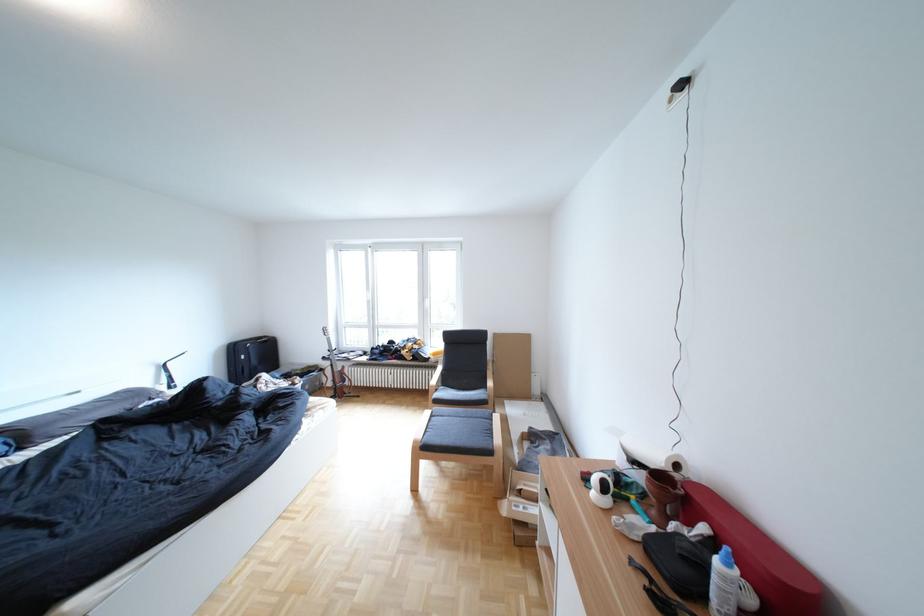
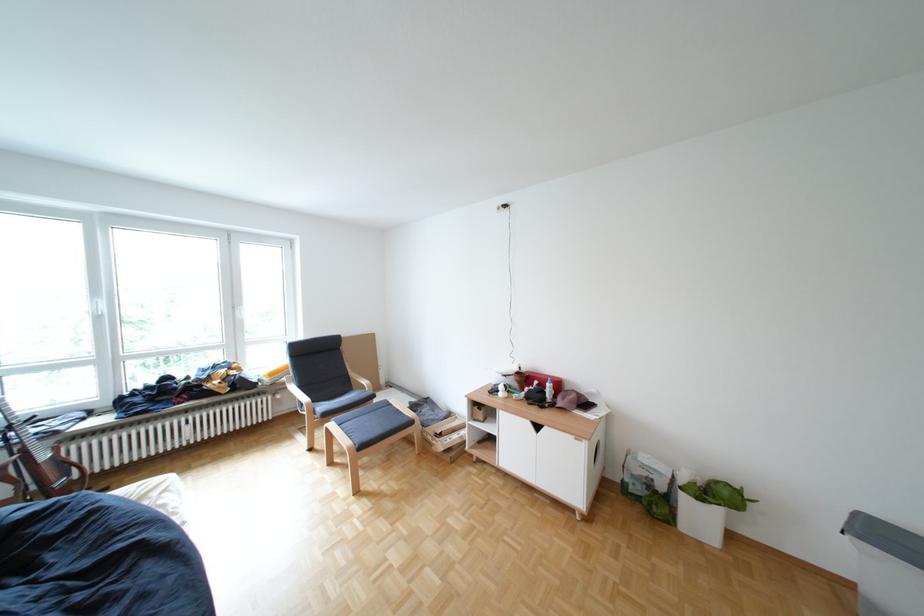
Where in the second image is the point corresponding to point (383, 302) from the first image?

(114, 318)